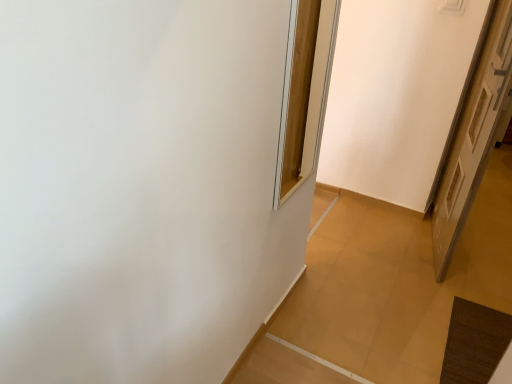
This screenshot has height=384, width=512. What are the coordinates of `free spot to the left of white wooden door at right` in the screenshot? It's located at (375, 241).